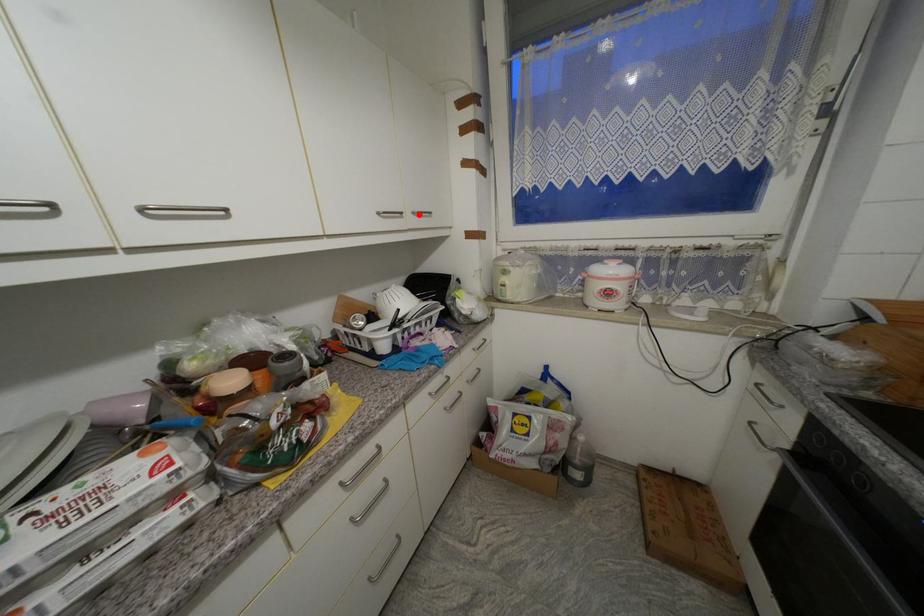
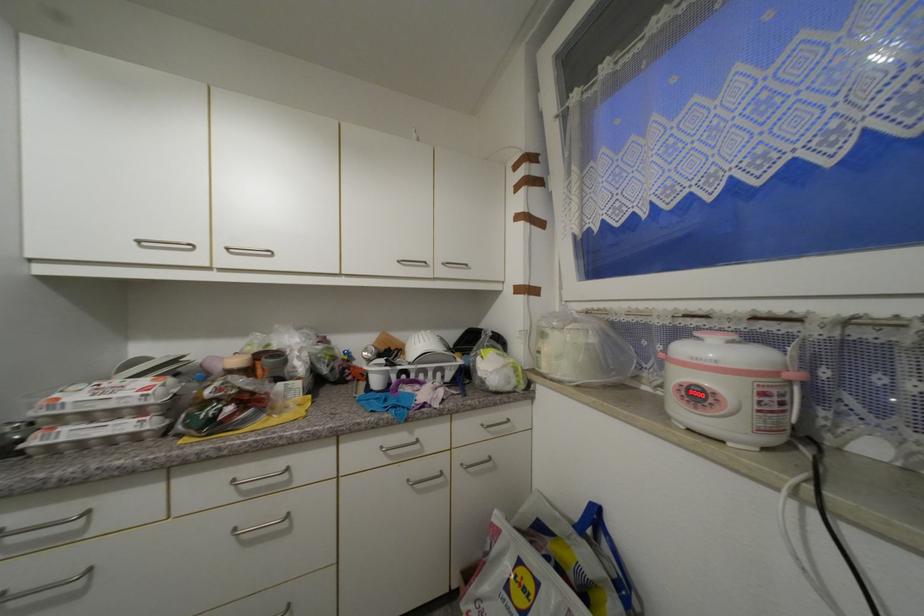
The point at the highlighted location is marked in the first image. Where is the corresponding point in the second image?

(448, 265)